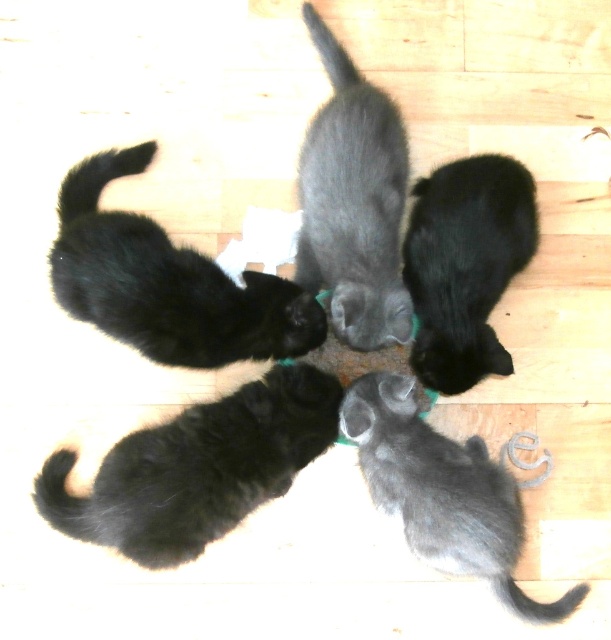
You are a cat owner who wants to ensure all kittens have enough space to eat. The gray fluffy kitten at center and the black soft fur kitten at center are both near the food bowl. Which kitten requires more space to accommodate its size?

The gray fluffy kitten at center requires more space because it has a larger size compared to the black soft fur kitten at center.

From the picture: You are a photographer trying to capture a group photo of the kittens. You want to ensure that both the gray fluffy kitten at center and the black soft fur kitten at center are fully visible in the frame. Based on their sizes, which kitten might require more space to the left to fit in the photo?

The gray fluffy kitten at center might be wider than the black soft fur kitten at center, so it might require more space to the left to fit in the photo.